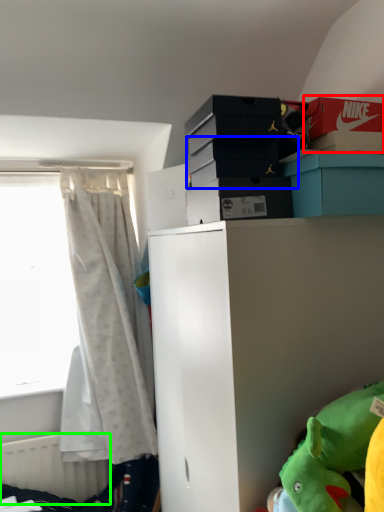
Question: Which object is the closest to the storage box (highlighted by a red box)? Choose among these: storage box (highlighted by a blue box) or radiator (highlighted by a green box).

Choices:
 (A) storage box
 (B) radiator

Answer: (A)